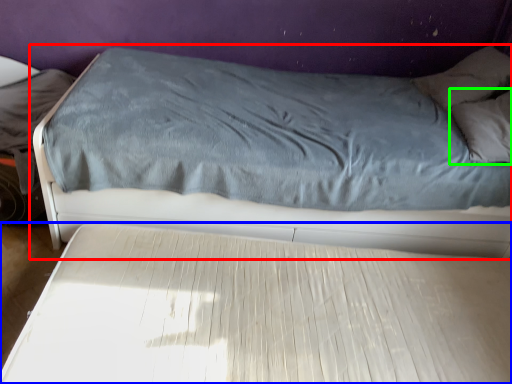
Question: Based on their relative distances, which object is farther from bed (highlighted by a red box)? Choose from bed (highlighted by a blue box) and pillow (highlighted by a green box).

Choices:
 (A) bed
 (B) pillow

Answer: (B)